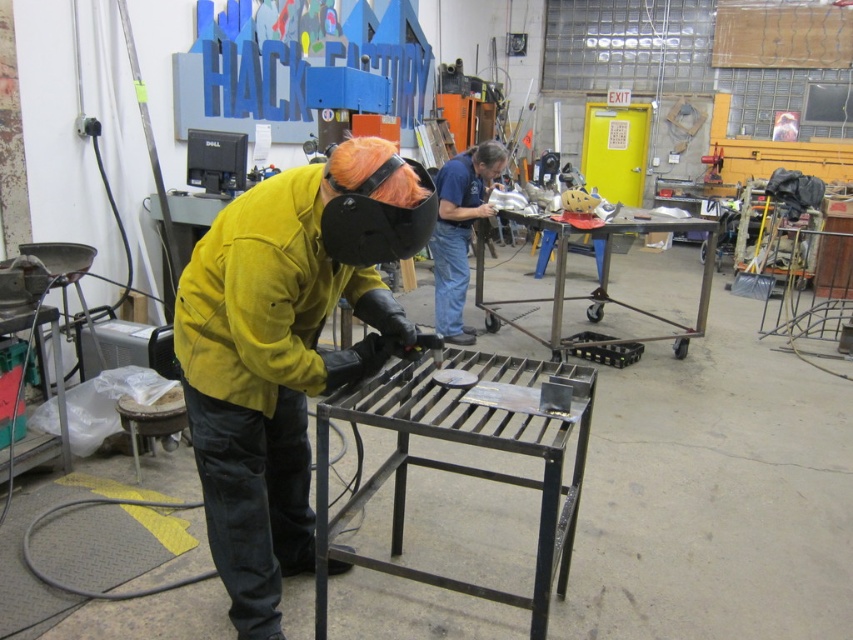
Question: Considering the relative positions of yellow leather jacket at center and blue denim shirt at center in the image provided, where is yellow leather jacket at center located with respect to blue denim shirt at center?

Choices:
 (A) above
 (B) below

Answer: (B)

Question: Is yellow leather jacket at center further to camera compared to blue denim shirt at center?

Choices:
 (A) yes
 (B) no

Answer: (B)

Question: Can you confirm if yellow leather jacket at center is wider than blue denim shirt at center?

Choices:
 (A) no
 (B) yes

Answer: (B)

Question: Among these points, which one is farthest from the camera?

Choices:
 (A) (331, 257)
 (B) (485, 154)

Answer: (B)